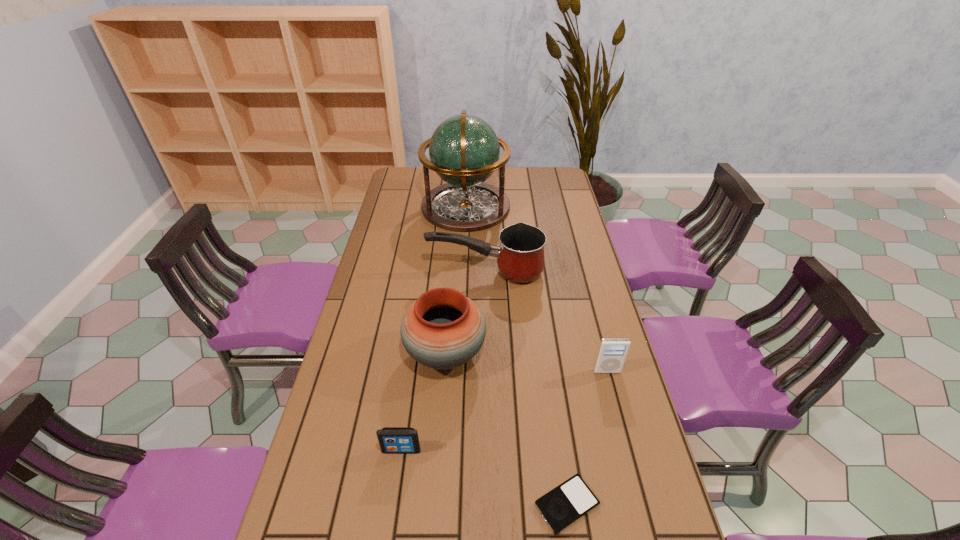
Where is `the shortest object`? The image size is (960, 540). the shortest object is located at coordinates (568, 502).

This screenshot has height=540, width=960. I want to click on vacant point located 0.090m on the front-facing side of the farthest object, so click(x=530, y=207).

Where is `vacant space positioned 0.110m on the right of the pottery`? vacant space positioned 0.110m on the right of the pottery is located at coordinates (522, 354).

Locate an element on the screen. free region located 0.120m on the handle side of the third tallest object is located at coordinates (396, 272).

The width and height of the screenshot is (960, 540). Find the location of `vacant area situated on the handle side of the third tallest object`. vacant area situated on the handle side of the third tallest object is located at coordinates (384, 272).

Locate an element on the screen. vacant area located on the handle side of the third tallest object is located at coordinates (406, 272).

You are a GUI agent. You are given a task and a screenshot of the screen. Output one action in this format:
    pyautogui.click(x=<x>, y=<y>)
    Task: Click on the free space located 0.290m on the front-facing side of the rightmost iPod
    The image size is (960, 540).
    Given the screenshot: What is the action you would take?
    pyautogui.click(x=634, y=472)

Locate an element on the screen. free space located 0.140m on the front screen of the second tallest iPod is located at coordinates (393, 513).

At what (x,y) coordinates should I click in order to perform the action: click on vacant space located 0.240m on the left of the shortest iPod. Please return your answer as a coordinate pair (x, y). The width and height of the screenshot is (960, 540). Looking at the image, I should click on (430, 504).

Find the location of a particular element. The width and height of the screenshot is (960, 540). object that is at the far edge is located at coordinates (464, 151).